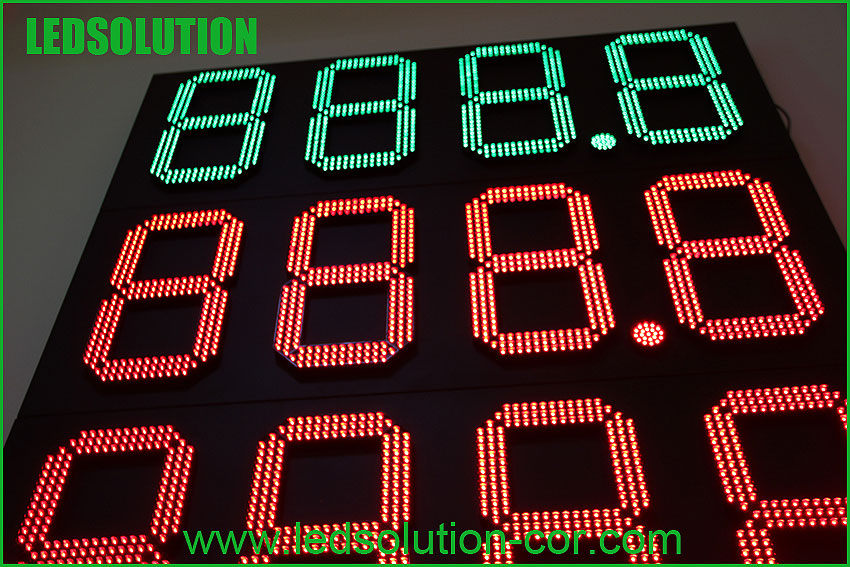
Find the location of a particular element. left corner is located at coordinates (831, 18).